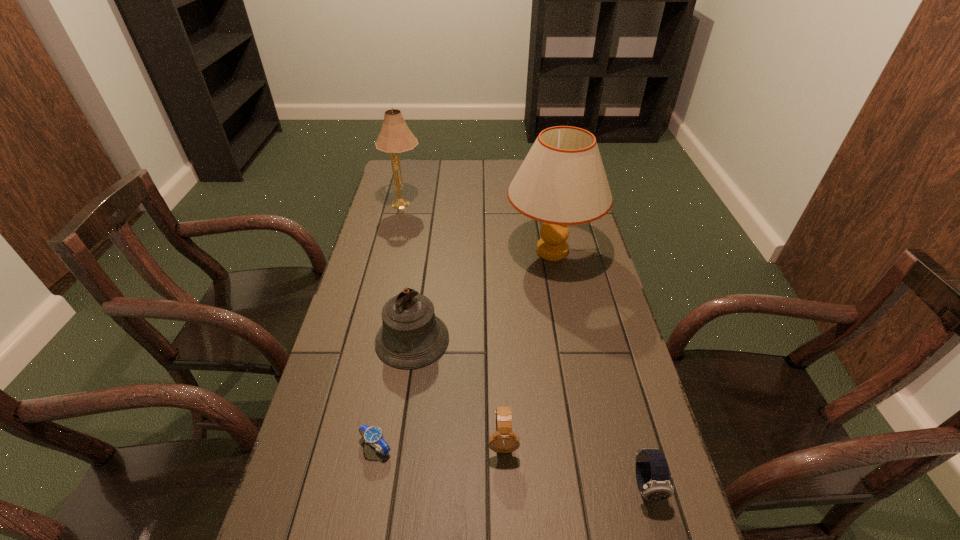
Where is `watch that is at the right edge`? This screenshot has height=540, width=960. watch that is at the right edge is located at coordinates (652, 473).

In the image, there is a desktop. At what (x,y) coordinates should I click in order to perform the action: click on blank space at the far edge. Please return your answer as a coordinate pair (x, y). This screenshot has height=540, width=960. Looking at the image, I should click on (456, 174).

The height and width of the screenshot is (540, 960). Find the location of `vacant space at the left edge`. vacant space at the left edge is located at coordinates (353, 402).

Where is `free space at the right edge`? free space at the right edge is located at coordinates (571, 315).

Image resolution: width=960 pixels, height=540 pixels. I want to click on free point between the left lampshade and the nearest object, so click(x=525, y=345).

You are a GUI agent. You are given a task and a screenshot of the screen. Output one action in this format:
    pyautogui.click(x=<x>, y=<y>)
    Task: Click on the vacant space that is in between the farther lampshade and the fourth shortest object
    The image size is (960, 540).
    Given the screenshot: What is the action you would take?
    pyautogui.click(x=408, y=272)

Locate an element on the screen. The image size is (960, 540). empty location between the leftmost watch and the fifth nearest object is located at coordinates (464, 349).

At what (x,y) coordinates should I click in order to perform the action: click on free spot between the second farthest object and the second watch from left to right. Please return your answer as a coordinate pair (x, y). Looking at the image, I should click on (527, 346).

The width and height of the screenshot is (960, 540). Find the location of `vacant space that is in between the bell and the nearest object`. vacant space that is in between the bell and the nearest object is located at coordinates coord(529,412).

Locate an element on the screen. vacant space in between the leftmost watch and the second watch from right to left is located at coordinates (440, 444).